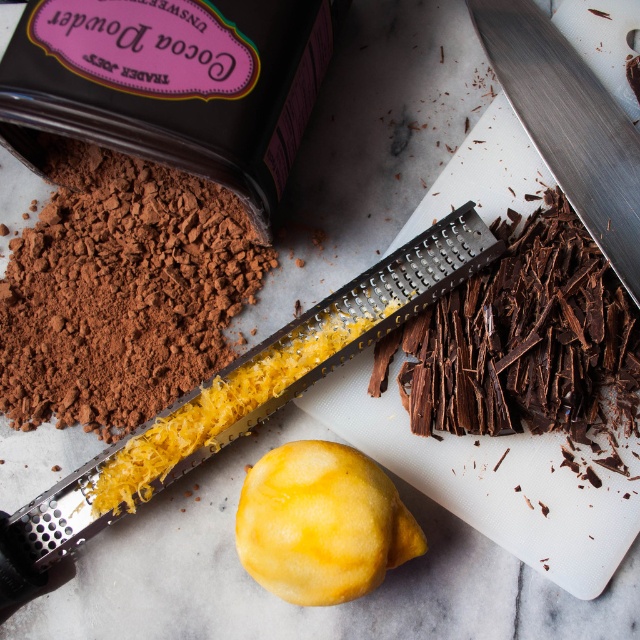
You are a chef preparing a dessert and need to know which item is shorter between the yellow matte lemon at center and the polished stainless steel knife at upper right. Can you identify the shorter object?

The yellow matte lemon at center is shorter than the polished stainless steel knife at upper right.

You are a chef preparing a dish and need to know which object is wider between the yellow matte lemon at center and the polished stainless steel knife at upper right. Can you determine this?

The yellow matte lemon at center might be wider than polished stainless steel knife at upper right, so it is possible that the lemon is wider.

You are standing 1.5 meters away from the scene. Can you reach the point at coordinates point [369,576] without moving your position?

The point at coordinates point [369,576] is 1.12 meters from the viewer. Since you are standing 1.5 meters away from the scene, you are farther than the point, so you cannot reach it without moving closer.